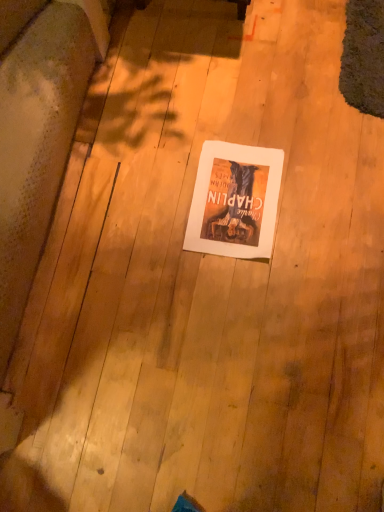
Find the location of a particular element. This screenshot has height=512, width=384. vacant space underneath white paper poster at center (from a real-world perspective) is located at coordinates (235, 207).